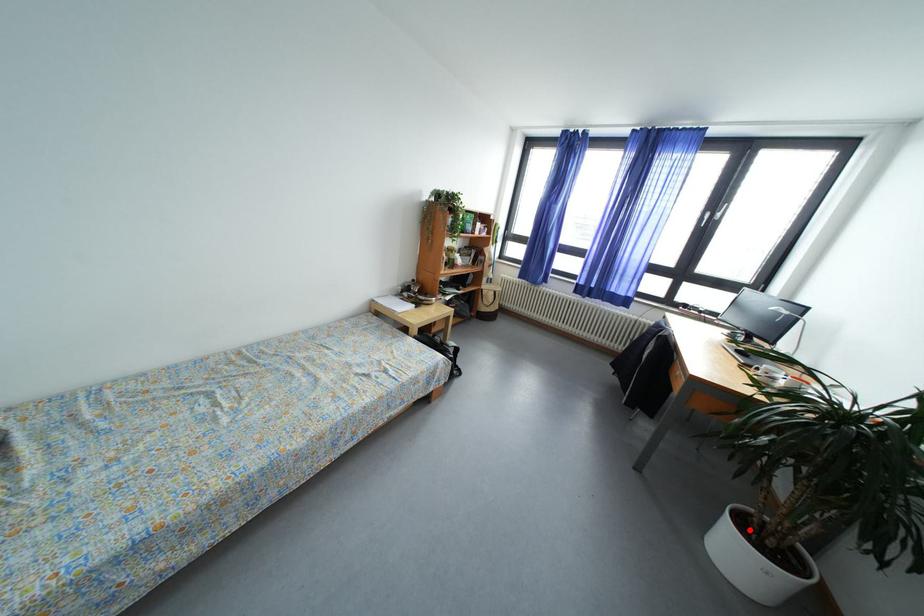
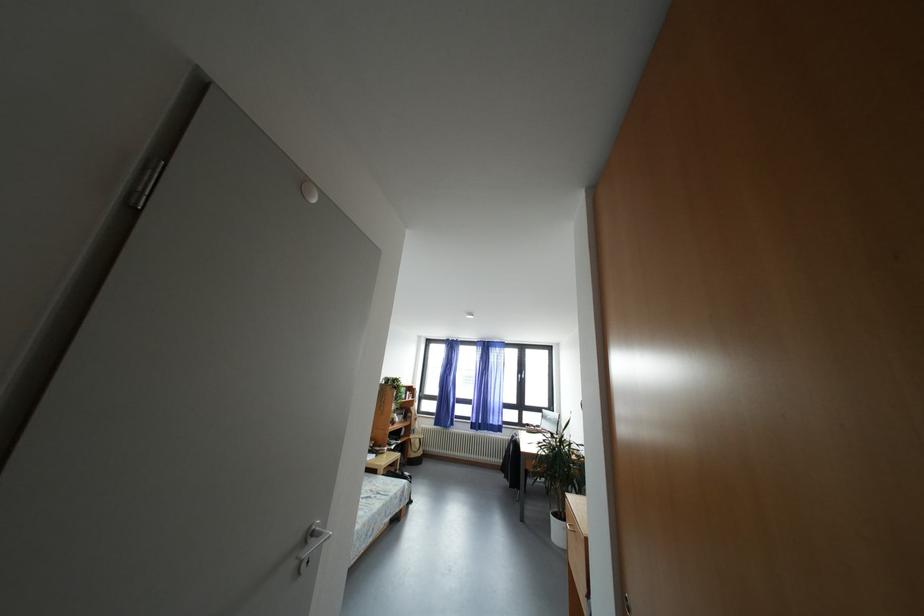
Question: I am providing you with two images of the same scene from different viewpoints. Given a red point in image1, look at the same physical point in image2. Is it:

Choices:
 (A) Closer to the viewpoint
 (B) Farther from the viewpoint

Answer: (B)